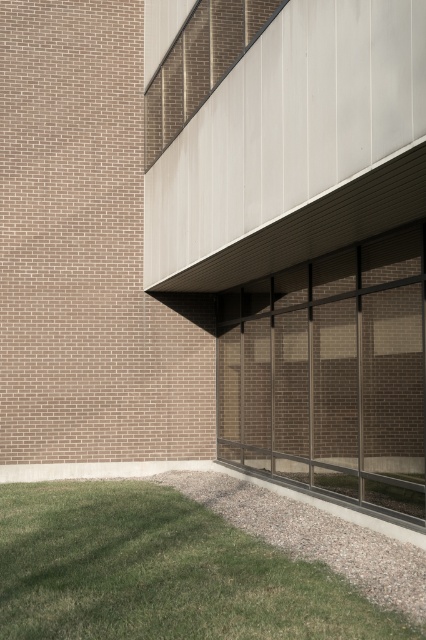
Who is positioned more to the right, clear glass windows at center or green grass at lower left?

clear glass windows at center

Is clear glass windows at center further to camera compared to green grass at lower left?

That is True.

Measure the distance between clear glass windows at center and camera.

They are 9.60 meters apart.

Where is `clear glass windows at center`? clear glass windows at center is located at coordinates click(331, 372).